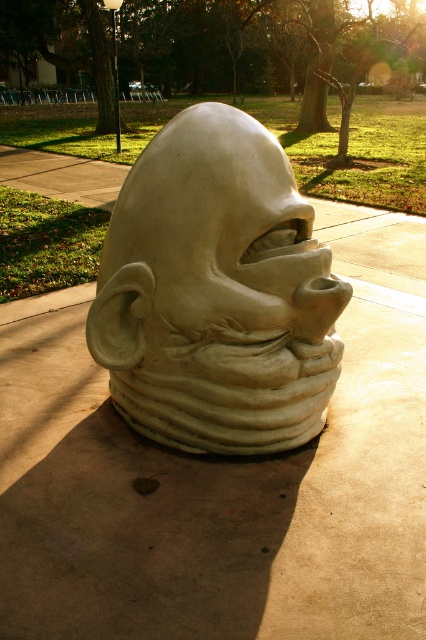
Question: Can you confirm if white matte sculpture at center is thinner than matte clay face at center?

Choices:
 (A) yes
 (B) no

Answer: (B)

Question: Is white matte sculpture at center thinner than matte clay face at center?

Choices:
 (A) yes
 (B) no

Answer: (B)

Question: Which point is closer to the camera?

Choices:
 (A) matte clay face at center
 (B) white matte sculpture at center

Answer: (A)

Question: Does white matte sculpture at center appear under matte clay face at center?

Choices:
 (A) no
 (B) yes

Answer: (B)